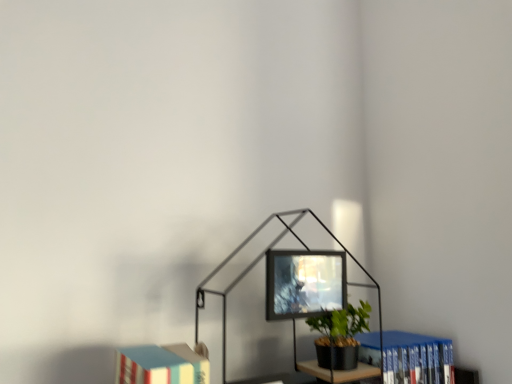
Question: Is matte black monitor at center positioned with its back to metallic black table lamp at center?

Choices:
 (A) no
 (B) yes

Answer: (B)

Question: Does matte black monitor at center have a smaller size compared to metallic black table lamp at center?

Choices:
 (A) no
 (B) yes

Answer: (B)

Question: Would you consider matte black monitor at center to be distant from metallic black table lamp at center?

Choices:
 (A) yes
 (B) no

Answer: (B)

Question: From a real-world perspective, is matte black monitor at center positioned over metallic black table lamp at center based on gravity?

Choices:
 (A) no
 (B) yes

Answer: (B)

Question: Does matte black monitor at center have a lesser width compared to metallic black table lamp at center?

Choices:
 (A) no
 (B) yes

Answer: (B)

Question: Can you confirm if matte black monitor at center is positioned to the left of metallic black table lamp at center?

Choices:
 (A) no
 (B) yes

Answer: (A)

Question: From a real-world perspective, is hardcover book at lower left, which appears as the second book when viewed from the back, beneath matte black monitor at center?

Choices:
 (A) yes
 (B) no

Answer: (A)

Question: Is hardcover book at lower left, which ranks as the second book in right-to-left order, turned away from matte black monitor at center?

Choices:
 (A) no
 (B) yes

Answer: (A)

Question: From the image's perspective, is hardcover book at lower left, which ranks as the 1th book in left-to-right order, above matte black monitor at center?

Choices:
 (A) no
 (B) yes

Answer: (A)

Question: Does hardcover book at lower left, which ranks as the second book in right-to-left order, have a greater height compared to matte black monitor at center?

Choices:
 (A) yes
 (B) no

Answer: (A)

Question: Can you confirm if hardcover book at lower left, which appears as the second book when viewed from the back, is shorter than matte black monitor at center?

Choices:
 (A) no
 (B) yes

Answer: (A)

Question: Can you confirm if hardcover book at lower left, which appears as the second book when viewed from the back, is thinner than matte black monitor at center?

Choices:
 (A) no
 (B) yes

Answer: (A)

Question: Are blue hardcover book at lower right, the first book viewed from the back, and hardcover book at lower left, which ranks as the 1th book in left-to-right order, far apart?

Choices:
 (A) yes
 (B) no

Answer: (B)